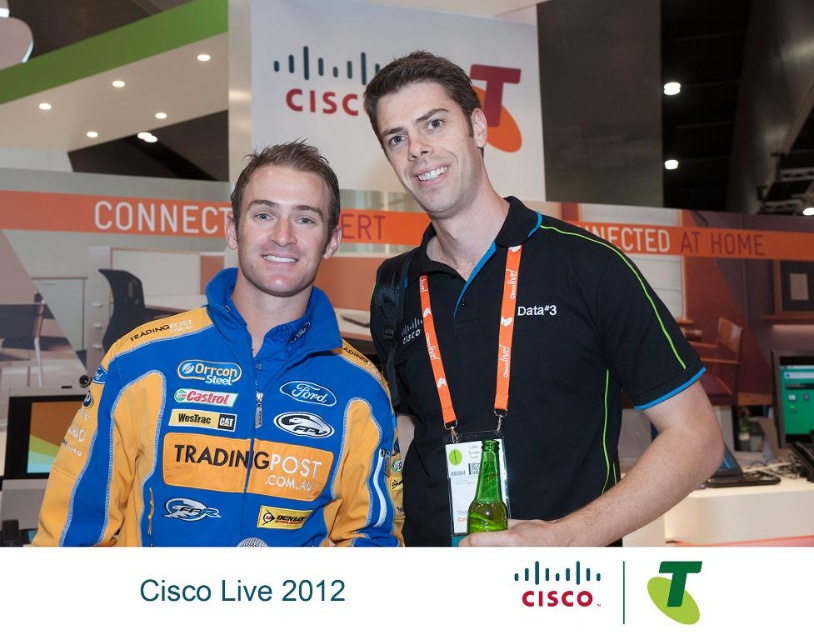
Question: Is black polyester polo shirt at center bigger than blue jersey at center?

Choices:
 (A) no
 (B) yes

Answer: (B)

Question: Is blue jersey at center below green glass bottle at center?

Choices:
 (A) yes
 (B) no

Answer: (B)

Question: Estimate the real-world distances between objects in this image. Which object is closer to the green glass bottle at center?

Choices:
 (A) black polyester polo shirt at center
 (B) blue jersey at center

Answer: (A)

Question: Which point is closer to the camera?

Choices:
 (A) green glass bottle at center
 (B) blue jersey at center

Answer: (A)

Question: In this image, where is blue jersey at center located relative to green glass bottle at center?

Choices:
 (A) left
 (B) right

Answer: (A)

Question: Which point is closer to the camera?

Choices:
 (A) black polyester polo shirt at center
 (B) blue jersey at center
 (C) green glass bottle at center

Answer: (A)